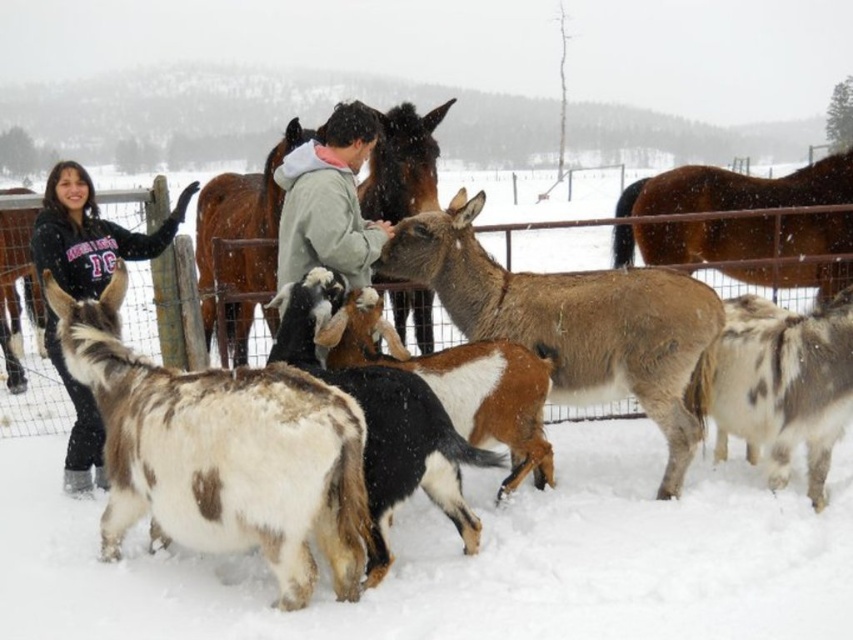
From the picture: You are a farmer who wants to choose the taller goat to give a special treat. Which goat should you choose between the brown and white fur goat at center and the brown speckled fur at center?

The brown and white fur goat at center is taller than the brown speckled fur at center, so you should choose the brown and white fur goat at center for the special treat.